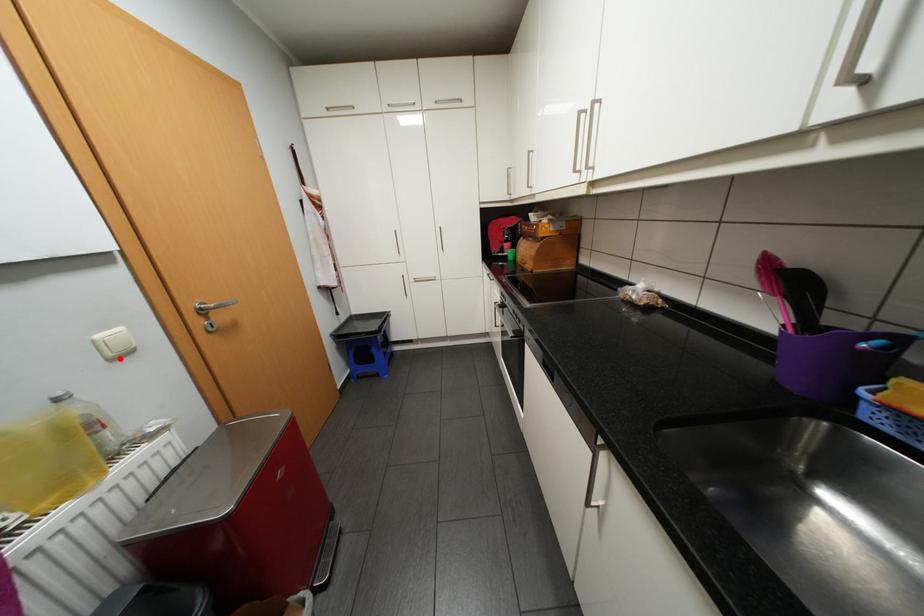
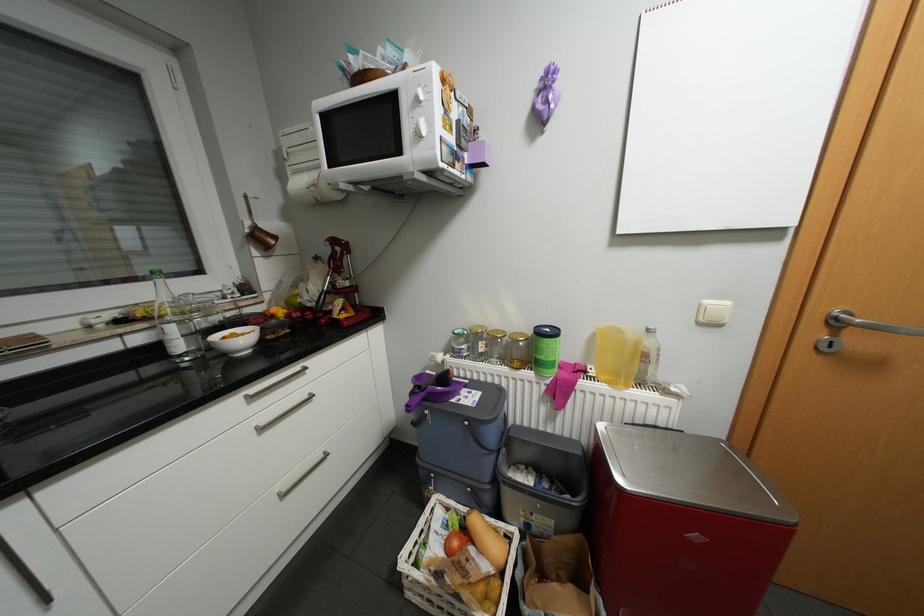
Locate, in the second image, the point that corresponds to the highlighted location in the first image.

(708, 323)